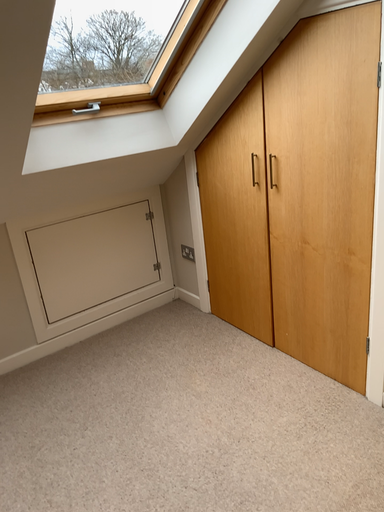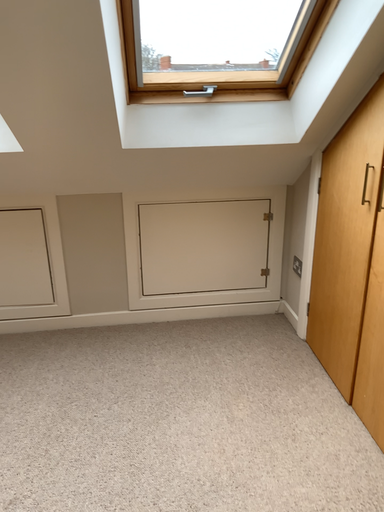
Question: How did the camera likely rotate when shooting the video?

Choices:
 (A) rotated right
 (B) rotated left

Answer: (B)